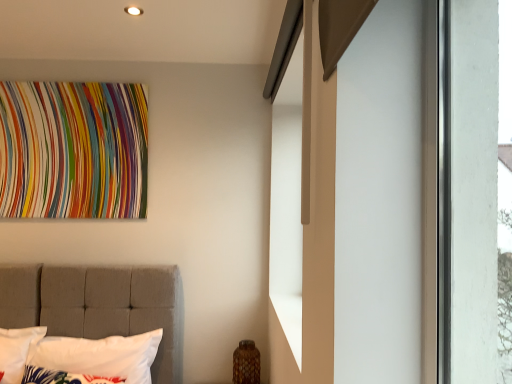
This screenshot has width=512, height=384. In order to click on white fabric pillow at lower left, the 1th pillow viewed from the front in this screenshot , I will do `click(64, 377)`.

Measure the distance between point (70,347) and camera.

The distance of point (70,347) from camera is 2.33 meters.

Locate an element on the screen. Image resolution: width=512 pixels, height=384 pixels. multicolored fabric tapestry at upper left is located at coordinates (73, 150).

Considering the points (132, 116) and (85, 350), which point is in front, point (132, 116) or point (85, 350)?

The point (85, 350) is closer to the camera.

Is white tufted pillow at left, which is the second pillow in front-to-back order, a part of multicolored fabric tapestry at upper left?

No, white tufted pillow at left, which is the second pillow in front-to-back order, is located outside of multicolored fabric tapestry at upper left.

Find the location of `tapestry that appears above the white tufted pillow at left, the first pillow positioned from the back (from the image's perspective)`. tapestry that appears above the white tufted pillow at left, the first pillow positioned from the back (from the image's perspective) is located at coordinates (73, 150).

Considering the positions of points (54, 200) and (66, 382), is point (54, 200) closer to camera compared to point (66, 382)?

No, (54, 200) is behind (66, 382).

Would you consider multicolored fabric tapestry at upper left to be distant from white fabric pillow at lower left, acting as the 2th pillow starting from the back?

multicolored fabric tapestry at upper left is positioned a significant distance from white fabric pillow at lower left, acting as the 2th pillow starting from the back.

Can we say multicolored fabric tapestry at upper left lies outside white fabric pillow at lower left, acting as the 2th pillow starting from the back?

Indeed, multicolored fabric tapestry at upper left is completely outside white fabric pillow at lower left, acting as the 2th pillow starting from the back.

Does white tufted pillow at left, which is the second pillow in front-to-back order, turn towards white fabric pillow at lower left, the 1th pillow viewed from the front?

Yes, white tufted pillow at left, which is the second pillow in front-to-back order, faces towards white fabric pillow at lower left, the 1th pillow viewed from the front.

From a real-world perspective, is white tufted pillow at left, which is the second pillow in front-to-back order, physically above white fabric pillow at lower left, the 1th pillow viewed from the front?

Indeed, from a real-world perspective, white tufted pillow at left, which is the second pillow in front-to-back order, stands above white fabric pillow at lower left, the 1th pillow viewed from the front.

Based on the photo, does white tufted pillow at left, the first pillow positioned from the back, have a smaller size compared to white fabric pillow at lower left, the 1th pillow viewed from the front?

Actually, white tufted pillow at left, the first pillow positioned from the back, might be larger than white fabric pillow at lower left, the 1th pillow viewed from the front.

Considering the sizes of objects white tufted pillow at left, which is the second pillow in front-to-back order, and white fabric pillow at lower left, the 1th pillow viewed from the front, in the image provided, who is shorter, white tufted pillow at left, which is the second pillow in front-to-back order, or white fabric pillow at lower left, the 1th pillow viewed from the front,?

white fabric pillow at lower left, the 1th pillow viewed from the front.

Between white fabric pillow at lower left, acting as the 2th pillow starting from the back, and multicolored fabric tapestry at upper left, which one has smaller size?

With smaller size is white fabric pillow at lower left, acting as the 2th pillow starting from the back.

Is white fabric pillow at lower left, the 1th pillow viewed from the front, thinner than multicolored fabric tapestry at upper left?

No, white fabric pillow at lower left, the 1th pillow viewed from the front, is not thinner than multicolored fabric tapestry at upper left.

Looking at this image, can multicolored fabric tapestry at upper left be found inside white fabric pillow at lower left, the 1th pillow viewed from the front?

No, multicolored fabric tapestry at upper left is not surrounded by white fabric pillow at lower left, the 1th pillow viewed from the front.

Which object is more forward, white fabric pillow at lower left, acting as the 2th pillow starting from the back, or multicolored fabric tapestry at upper left?

white fabric pillow at lower left, acting as the 2th pillow starting from the back, is closer to the camera.

From the image's perspective, which one is positioned lower, white fabric pillow at lower left, acting as the 2th pillow starting from the back, or white tufted pillow at left, which is the second pillow in front-to-back order?

white fabric pillow at lower left, acting as the 2th pillow starting from the back, appears lower in the image.

Would you say white fabric pillow at lower left, acting as the 2th pillow starting from the back, is outside white tufted pillow at left, which is the second pillow in front-to-back order?

No, white fabric pillow at lower left, acting as the 2th pillow starting from the back, is not entirely external to white tufted pillow at left, which is the second pillow in front-to-back order.

Which of these two, white fabric pillow at lower left, acting as the 2th pillow starting from the back, or white tufted pillow at left, which is the second pillow in front-to-back order, stands taller?

With more height is white tufted pillow at left, which is the second pillow in front-to-back order.

Considering the positions of objects white fabric pillow at lower left, the 1th pillow viewed from the front, and white tufted pillow at left, which is the second pillow in front-to-back order, in the image provided, who is behind, white fabric pillow at lower left, the 1th pillow viewed from the front, or white tufted pillow at left, which is the second pillow in front-to-back order,?

white tufted pillow at left, which is the second pillow in front-to-back order, is more distant.

Between white tufted pillow at left, the first pillow positioned from the back, and multicolored fabric tapestry at upper left, which one appears on the right side from the viewer's perspective?

Positioned to the right is white tufted pillow at left, the first pillow positioned from the back.

Is point (26, 380) positioned in front of point (10, 215)?

Yes, it is.

Is white tufted pillow at left, which is the second pillow in front-to-back order, touching multicolored fabric tapestry at upper left?

No, white tufted pillow at left, which is the second pillow in front-to-back order, is not making contact with multicolored fabric tapestry at upper left.

From a real-world perspective, is white tufted pillow at left, the first pillow positioned from the back, on multicolored fabric tapestry at upper left?

A: No, from a real-world perspective, white tufted pillow at left, the first pillow positioned from the back, is not above multicolored fabric tapestry at upper left.

I want to click on pillow that is the 2nd object to the right of the multicolored fabric tapestry at upper left, starting at the anchor, so pos(92,360).

Where is `pillow that is the 2nd object located below the multicolored fabric tapestry at upper left (from the image's perspective)`? Image resolution: width=512 pixels, height=384 pixels. pillow that is the 2nd object located below the multicolored fabric tapestry at upper left (from the image's perspective) is located at coordinates (64, 377).

When comparing their distances from white tufted pillow at left, the first pillow positioned from the back, does multicolored fabric tapestry at upper left or white fabric pillow at lower left, acting as the 2th pillow starting from the back, seem further?

Based on the image, multicolored fabric tapestry at upper left appears to be further to white tufted pillow at left, the first pillow positioned from the back.

Looking at the image, which one is located further to multicolored fabric tapestry at upper left, white tufted pillow at left, the first pillow positioned from the back, or white fabric pillow at lower left, the 1th pillow viewed from the front?

Based on the image, white fabric pillow at lower left, the 1th pillow viewed from the front, appears to be further to multicolored fabric tapestry at upper left.

Considering their positions, is white tufted pillow at left, which is the second pillow in front-to-back order, positioned further to white fabric pillow at lower left, acting as the 2th pillow starting from the back, than multicolored fabric tapestry at upper left?

multicolored fabric tapestry at upper left is further to white fabric pillow at lower left, acting as the 2th pillow starting from the back.

From the picture: Considering their positions, is white fabric pillow at lower left, the 1th pillow viewed from the front, positioned closer to multicolored fabric tapestry at upper left than white tufted pillow at left, which is the second pillow in front-to-back order?

white tufted pillow at left, which is the second pillow in front-to-back order, is closer to multicolored fabric tapestry at upper left.

Estimate the real-world distances between objects in this image. Which object is closer to white tufted pillow at left, which is the second pillow in front-to-back order, white fabric pillow at lower left, acting as the 2th pillow starting from the back, or multicolored fabric tapestry at upper left?

Based on the image, white fabric pillow at lower left, acting as the 2th pillow starting from the back, appears to be nearer to white tufted pillow at left, which is the second pillow in front-to-back order.

From the image, which object appears to be farther from white fabric pillow at lower left, the 1th pillow viewed from the front, multicolored fabric tapestry at upper left or white tufted pillow at left, which is the second pillow in front-to-back order?

The object further to white fabric pillow at lower left, the 1th pillow viewed from the front, is multicolored fabric tapestry at upper left.

Image resolution: width=512 pixels, height=384 pixels. I want to click on pillow between multicolored fabric tapestry at upper left and white fabric pillow at lower left, the 1th pillow viewed from the front, in the up-down direction, so click(x=92, y=360).